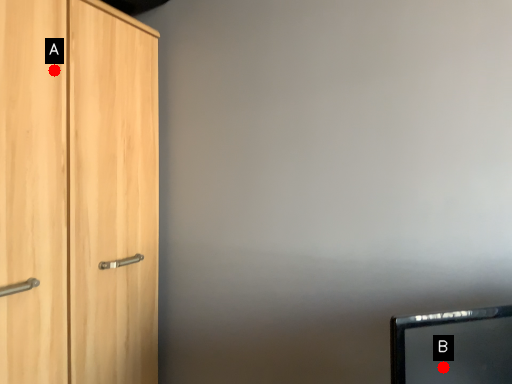
Question: Two points are circled on the image, labeled by A and B beside each circle. Which of the following is the closest to the observer?

Choices:
 (A) A is closer
 (B) B is closer

Answer: (B)